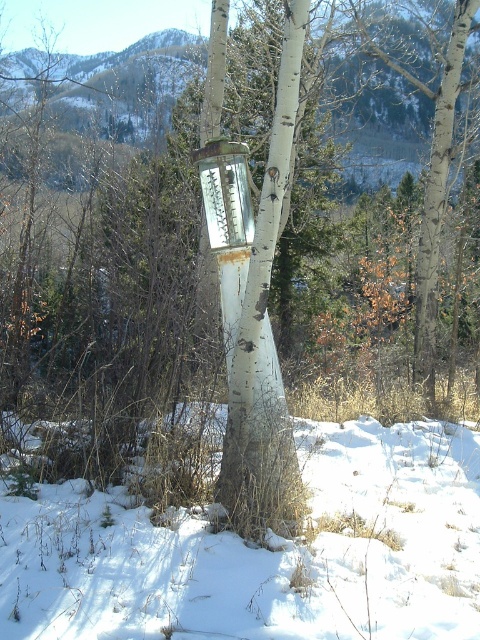
Question: Does white powdery snow at lower center appear on the left side of metallic glass thermometer at center?

Choices:
 (A) no
 (B) yes

Answer: (A)

Question: Is white powdery snow at lower center positioned before metallic glass thermometer at center?

Choices:
 (A) no
 (B) yes

Answer: (B)

Question: Does white powdery snow at lower center have a smaller size compared to metallic glass thermometer at center?

Choices:
 (A) no
 (B) yes

Answer: (A)